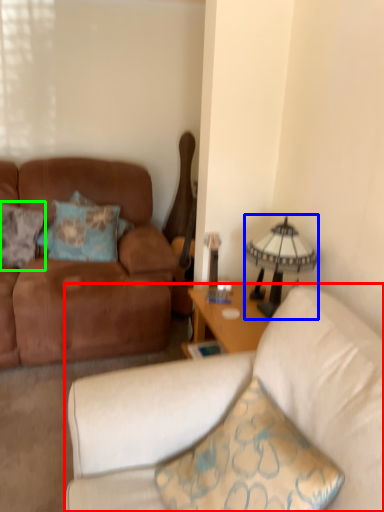
Question: Considering the real-world distances, which object is farthest from studio couch (highlighted by a red box)? lamp (highlighted by a blue box) or pillow (highlighted by a green box)?

Choices:
 (A) lamp
 (B) pillow

Answer: (B)